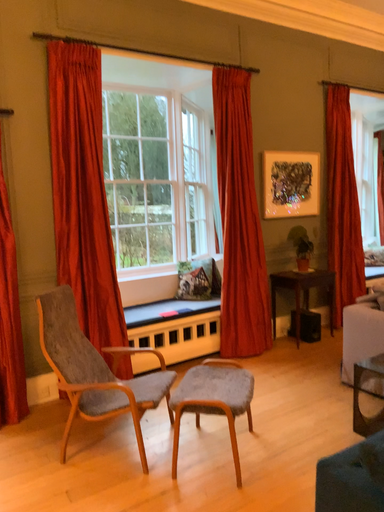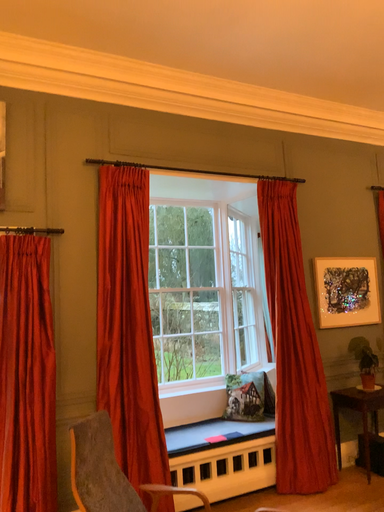
Question: Which way did the camera rotate in the video?

Choices:
 (A) rotated downward
 (B) rotated upward

Answer: (B)